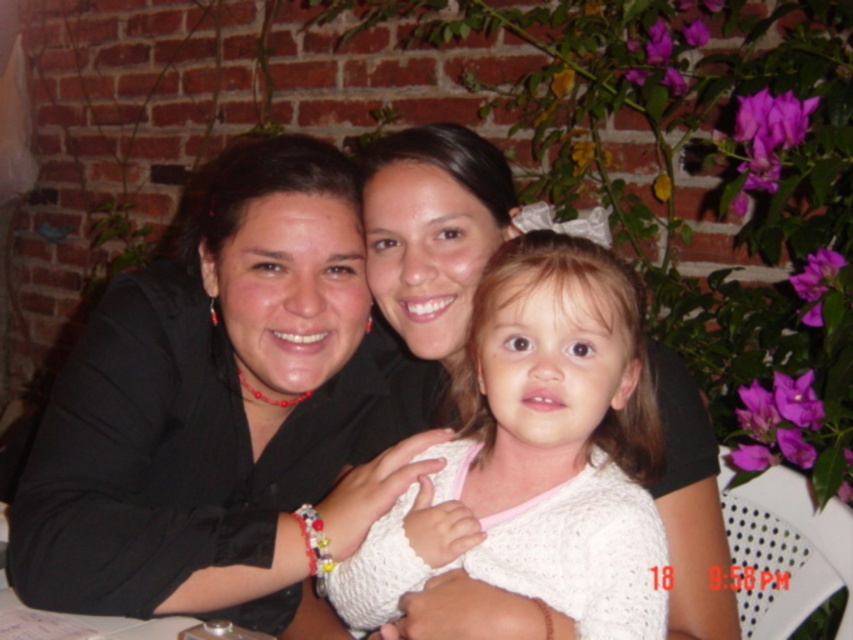
You are a fashion designer observing the scene. You notice the black matte jacket at center and the white knitted sweater at center. Which clothing item appears to be larger in size based on their height?

The black matte jacket at center is taller than the white knitted sweater at center, so the black matte jacket at center is larger in size.

You are a photographer adjusting the camera focus. You need to capture both the black matte jacket at center and the white knitted sweater at center in sharp focus. The camera can focus on objects within a 6 inch range. Can both items be in focus at the same time?

The black matte jacket at center and white knitted sweater at center are 7.31 inches apart. Since the camera can only focus on objects within a 6 inch range, the distance between them exceeds the focus range. Therefore, both items cannot be in focus simultaneously.

You are a photographer trying to capture a closeup of the black matte jacket at center and the white knitted sweater at center. Which one is located to the left of the other?

The black matte jacket at center is positioned on the left side of white knitted sweater at center.